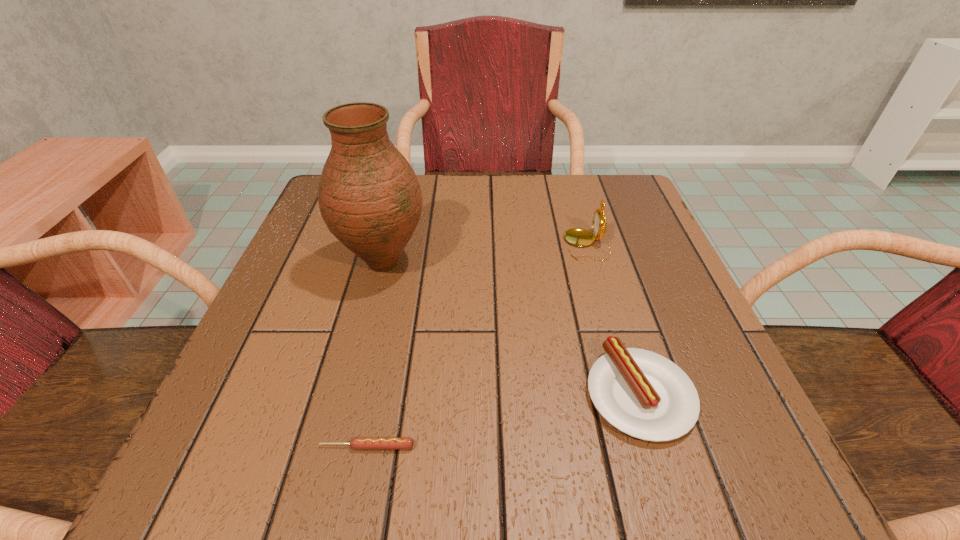
In order to click on vacant space situated 0.350m on the back of the third tallest object in this screenshot , I will do `click(587, 222)`.

Where is `vacant position located 0.050m on the front of the shortest object`? This screenshot has width=960, height=540. vacant position located 0.050m on the front of the shortest object is located at coordinates coord(358,492).

The width and height of the screenshot is (960, 540). I want to click on object that is at the far edge, so [x=580, y=237].

Identify the location of object that is at the left edge. The image size is (960, 540). pyautogui.click(x=369, y=197).

Where is `pocket watch positioned at the right edge`? This screenshot has height=540, width=960. pocket watch positioned at the right edge is located at coordinates 580,237.

You are a GUI agent. You are given a task and a screenshot of the screen. Output one action in this format:
    pyautogui.click(x=<x>, y=<y>)
    Task: Click on the sausage located in the right edge section of the desktop
    This screenshot has width=960, height=540.
    Given the screenshot: What is the action you would take?
    pyautogui.click(x=641, y=393)

Where is `object at the far right corner`? This screenshot has width=960, height=540. object at the far right corner is located at coordinates (580, 237).

Image resolution: width=960 pixels, height=540 pixels. Find the location of `object that is at the near right corner`. object that is at the near right corner is located at coordinates (641, 393).

The width and height of the screenshot is (960, 540). What are the coordinates of `free region at the far edge of the desktop` in the screenshot? It's located at (432, 232).

Find the location of a particular element. free region at the near edge of the desktop is located at coordinates (612, 470).